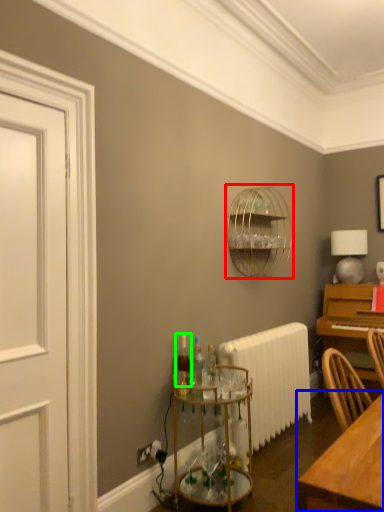
Question: Estimate the real-world distances between objects in this image. Which object is closer to bird cage (highlighted by a red box), table (highlighted by a blue box) or bottle (highlighted by a green box)?

Choices:
 (A) table
 (B) bottle

Answer: (B)